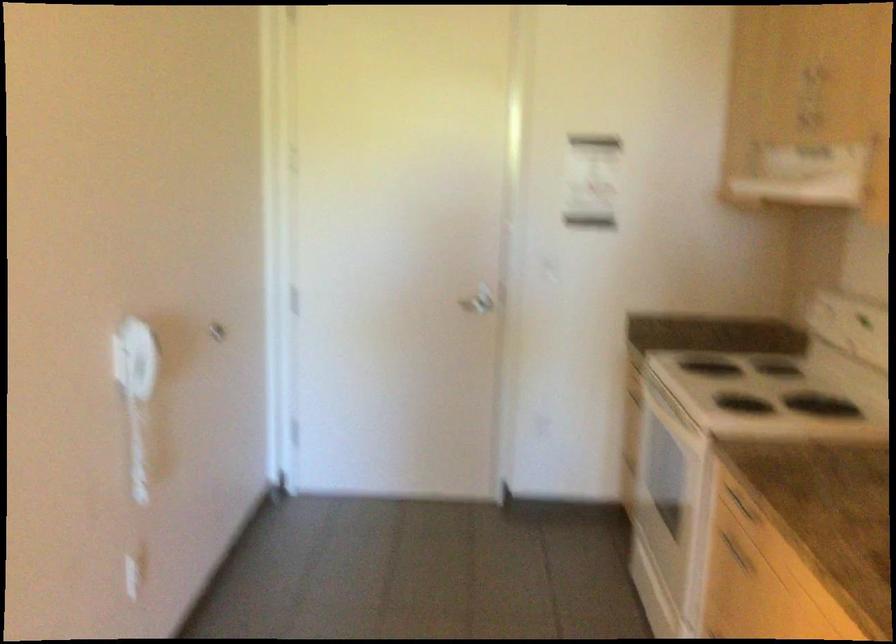
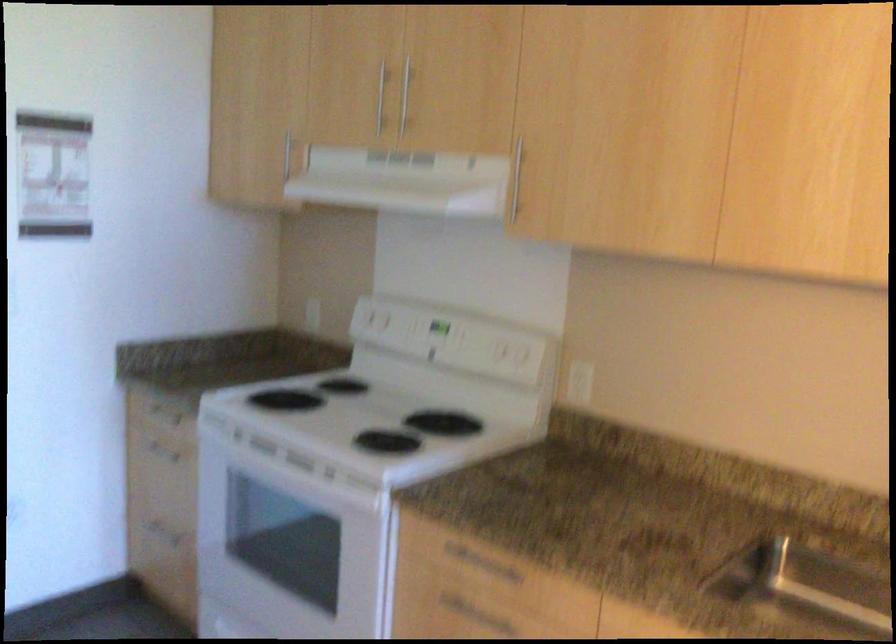
Where in the second image is the point corresponding to pixel 813 111 from the first image?

(380, 98)